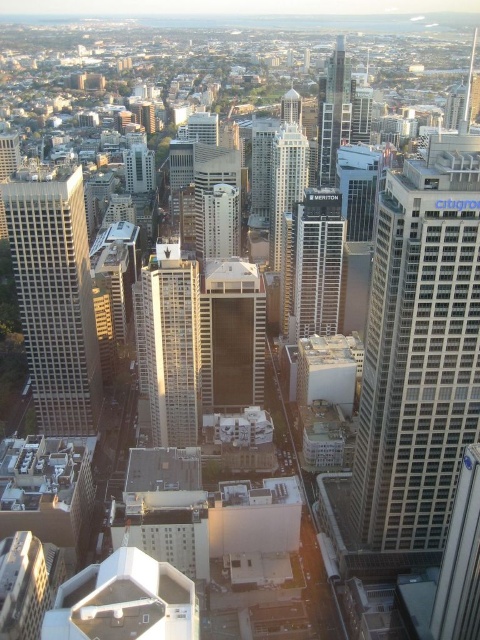
Can you confirm if white glass skyscraper at right is positioned to the right of metallic glass skyscraper at right?

No, white glass skyscraper at right is not to the right of metallic glass skyscraper at right.

Does white glass skyscraper at right have a greater width compared to metallic glass skyscraper at right?

Yes.

Who is more distant from viewer, (x=392, y=228) or (x=434, y=634)?

Point (x=434, y=634)

I want to click on white glass skyscraper at right, so click(x=420, y=349).

Which is in front, point (375, 547) or point (297, 324)?

Positioned in front is point (375, 547).

Who is more distant from viewer, (425, 301) or (286, 220)?

The point (286, 220) is behind.

What do you see at coordinates (420, 349) in the screenshot?
I see `white glass skyscraper at right` at bounding box center [420, 349].

At what (x,y) coordinates should I click in order to perform the action: click on white glass skyscraper at right. Please return your answer as a coordinate pair (x, y). Image resolution: width=480 pixels, height=640 pixels. Looking at the image, I should click on (420, 349).

Does shiny glass skyscraper at center have a larger size compared to metallic glass skyscraper at center?

No.

Does shiny glass skyscraper at center appear under metallic glass skyscraper at center?

Indeed, shiny glass skyscraper at center is positioned under metallic glass skyscraper at center.

Where is `shiny glass skyscraper at center`? Image resolution: width=480 pixels, height=640 pixels. shiny glass skyscraper at center is located at coordinates (286, 180).

Image resolution: width=480 pixels, height=640 pixels. Find the location of `shiny glass skyscraper at center`. shiny glass skyscraper at center is located at coordinates (286, 180).